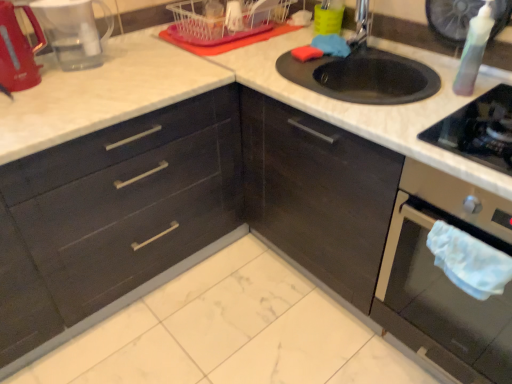
Identify the location of free space in front of transparent plastic bottle at upper right. (463, 114).